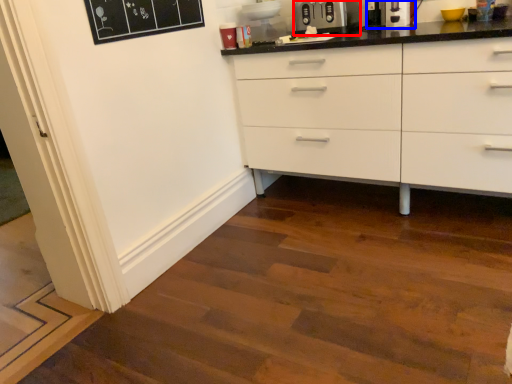
Question: Which of the following is the farthest to the observer, appliance (highlighted by a red box) or coffee machine (highlighted by a blue box)?

Choices:
 (A) appliance
 (B) coffee machine

Answer: (A)